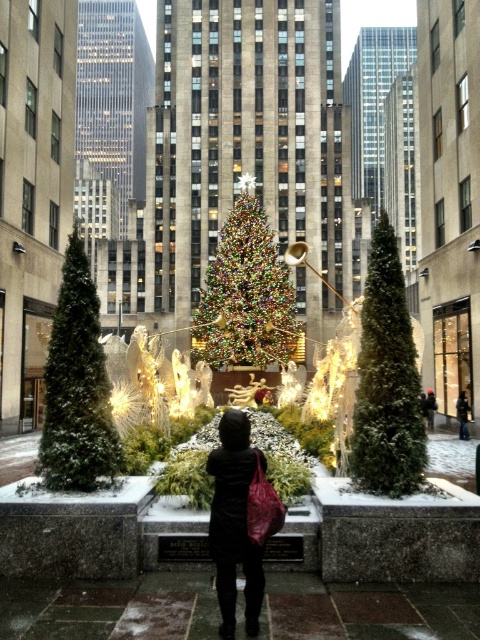
You are standing in the plaza looking at the festive decorations. There are two points marked in the image. Which point, point (x=369, y=282) or point (x=433, y=404), is closer to you?

Point (x=369, y=282) is closer to the camera than point (x=433, y=404).

You are a visitor at the plaza and want to take a photo of the green textured pine tree at center and the black matte coat at center. Which object should you focus on first if you want to capture both in a single frame without moving the camera?

The green textured pine tree at center is taller than the black matte coat at center, so you should focus on the green textured pine tree at center first to ensure it fits within the frame.